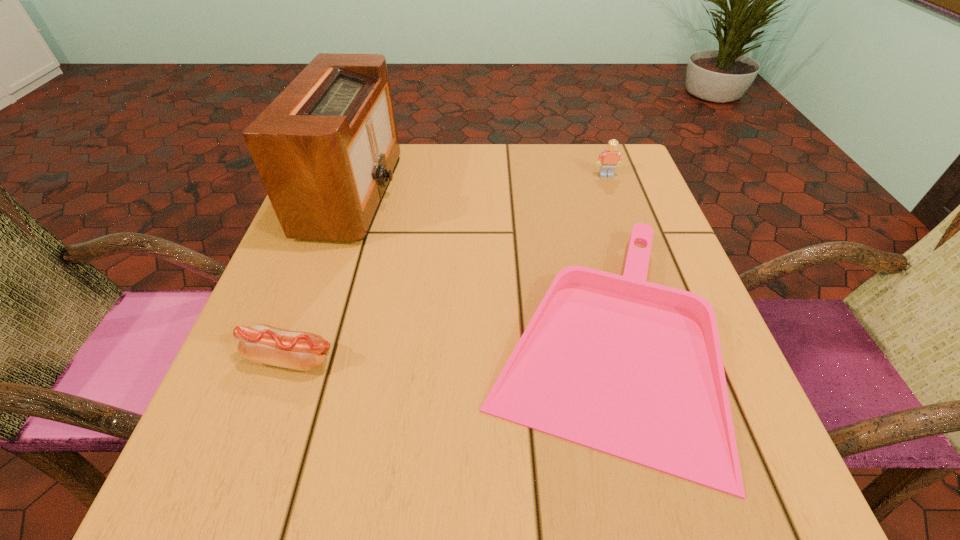
This screenshot has width=960, height=540. Find the location of `free space between the shortest object and the third tallest object`. free space between the shortest object and the third tallest object is located at coordinates tap(443, 348).

You are a GUI agent. You are given a task and a screenshot of the screen. Output one action in this format:
    pyautogui.click(x=<x>, y=<y>)
    Task: Click on the free space between the tallest object and the dustpan
    The image size is (960, 540).
    Given the screenshot: What is the action you would take?
    pyautogui.click(x=473, y=266)

The image size is (960, 540). Identify the location of free spot between the Lego and the third tallest object. (448, 267).

Where is `vacant area between the dustpan and the sausage`? The image size is (960, 540). vacant area between the dustpan and the sausage is located at coordinates (443, 348).

In order to click on vacant space in between the Lego and the third tallest object in this screenshot , I will do `click(448, 267)`.

Where is `vacant region between the second shortest object and the third shortest object`? Image resolution: width=960 pixels, height=540 pixels. vacant region between the second shortest object and the third shortest object is located at coordinates (448, 267).

Identify the location of object identified as the second closest to the Lego. This screenshot has width=960, height=540. (326, 148).

Locate an element on the screen. the third closest object relative to the Lego is located at coordinates pos(260,343).

At what (x,y) coordinates should I click in order to perform the action: click on free space that satisfies the following two spatial constraints: 1. on the front-facing side of the third shortest object; 2. on the handle side of the shortest object. Please return your answer as a coordinate pair (x, y). Looking at the image, I should click on (663, 339).

Where is `free space that satisfies the following two spatial constraints: 1. on the front-facing side of the second tallest object; 2. on the handle side of the dustpan`? The height and width of the screenshot is (540, 960). free space that satisfies the following two spatial constraints: 1. on the front-facing side of the second tallest object; 2. on the handle side of the dustpan is located at coordinates (663, 339).